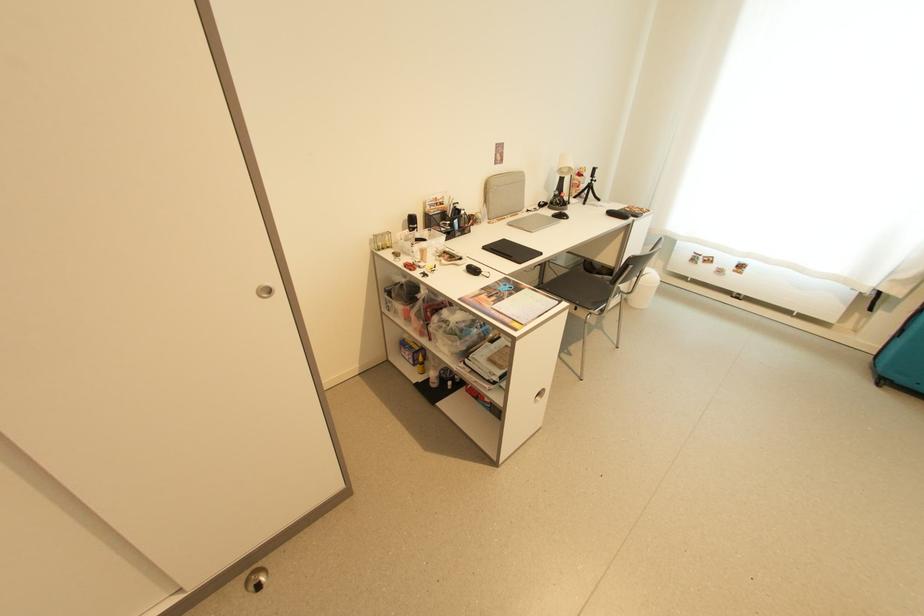
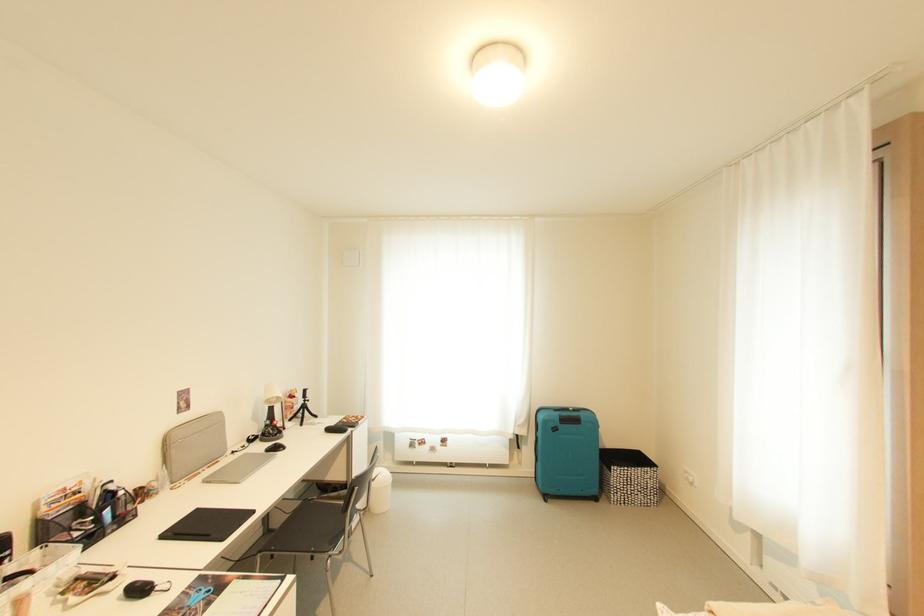
Where in the second image is the point corresponding to (505,283) from the first image?

(195, 589)